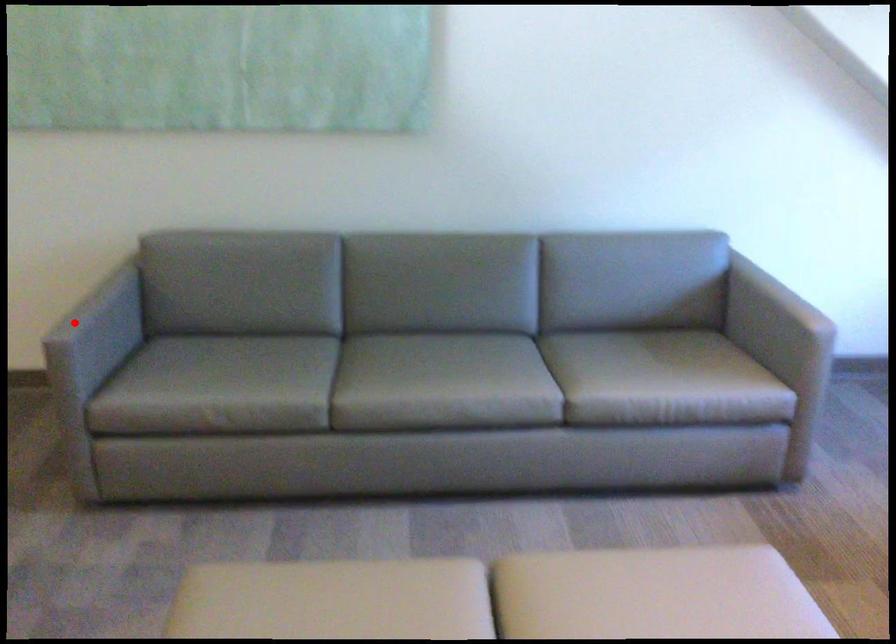
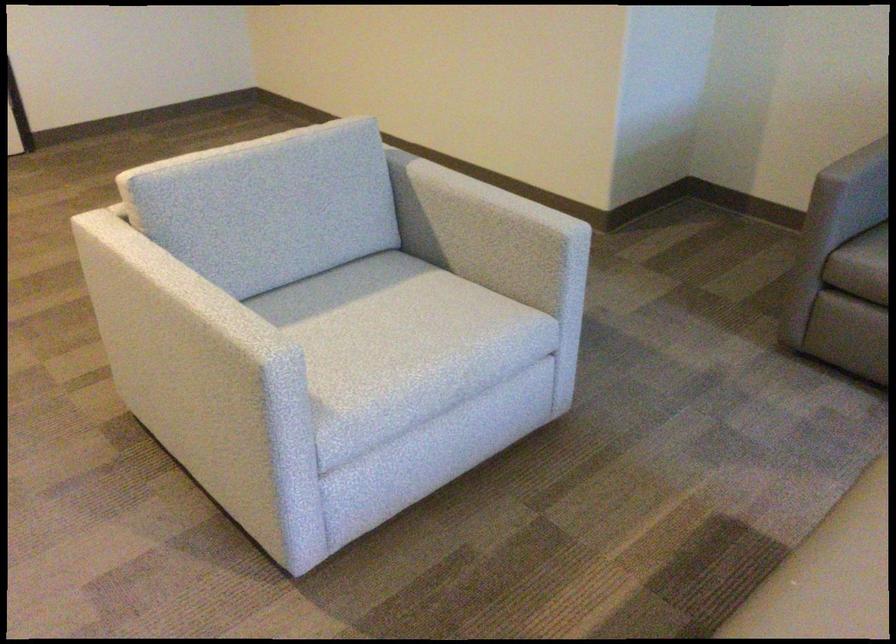
Where in the second image is the point corresponding to the highlighted location from the first image?

(858, 164)